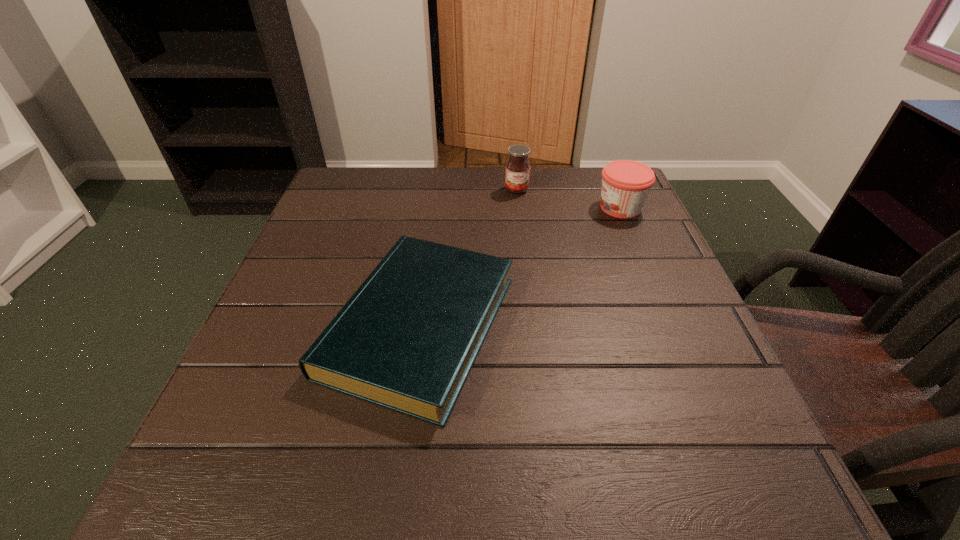
Locate an element on the screen. free space between the right jam and the second object from left to right is located at coordinates (568, 199).

The image size is (960, 540). I want to click on vacant area between the leftmost object and the rightmost object, so click(x=520, y=267).

Where is `vacant area that lies between the nearest object and the right jam`? The image size is (960, 540). vacant area that lies between the nearest object and the right jam is located at coordinates (520, 267).

I want to click on free space between the right jam and the second object from left to right, so click(568, 199).

I want to click on free space between the leftmost object and the right jam, so click(x=520, y=267).

I want to click on free space between the rightmost object and the left jam, so click(x=568, y=199).

This screenshot has height=540, width=960. What are the coordinates of `free point between the rightmost object and the left jam` in the screenshot? It's located at (568, 199).

You are a GUI agent. You are given a task and a screenshot of the screen. Output one action in this format:
    pyautogui.click(x=<x>, y=<y>)
    Task: Click on the closest object to the second object from right to left
    
    Given the screenshot: What is the action you would take?
    pyautogui.click(x=626, y=184)

Choose which object is the second nearest neighbor to the second object from right to left. Please provide its 2D coordinates. Your answer should be formatted as a tuple, i.e. [(x, y)], where the tuple contains the x and y coordinates of a point satisfying the conditions above.

[(406, 340)]

Locate an element on the screen. vacant point that satisfies the following two spatial constraints: 1. on the front label of the rightmost object; 2. on the front side of the nearest object is located at coordinates (671, 326).